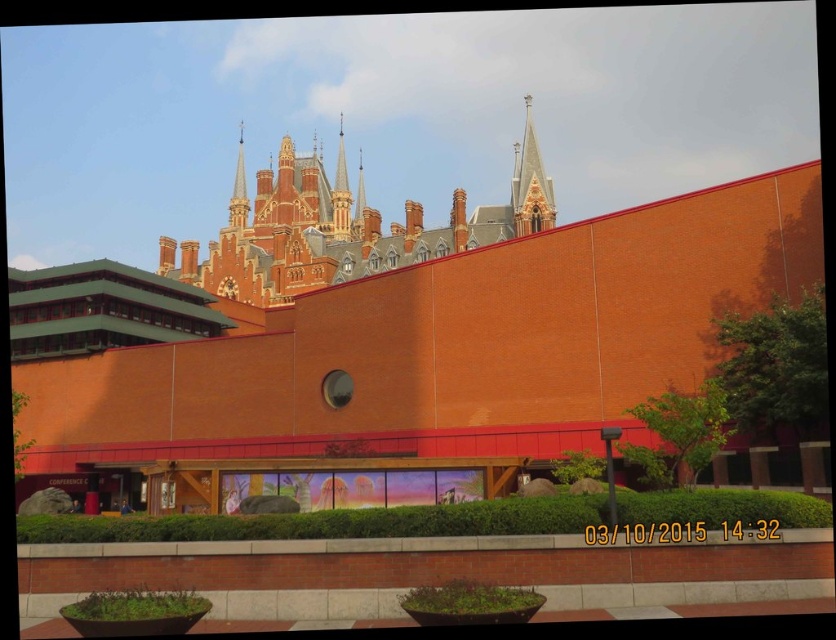
You are an architect analyzing the image. You see the red brick spire at upper center and the smooth brick spire at upper center. Which spire is located lower in the image?

The red brick spire at upper center is positioned under the smooth brick spire at upper center, so it is located lower in the image.

You are a drone operator tasked with capturing aerial footage of the brick church at upper center and the smooth brick spire at upper center. Your drone has a maximum range of 40 meters. Can the drone safely capture footage of both structures without exceeding its range?

The brick church at upper center is 42.23 meters away from the smooth brick spire at upper center. Since the drone has a maximum range of 40 meters, it cannot safely capture footage of both structures without exceeding its range.